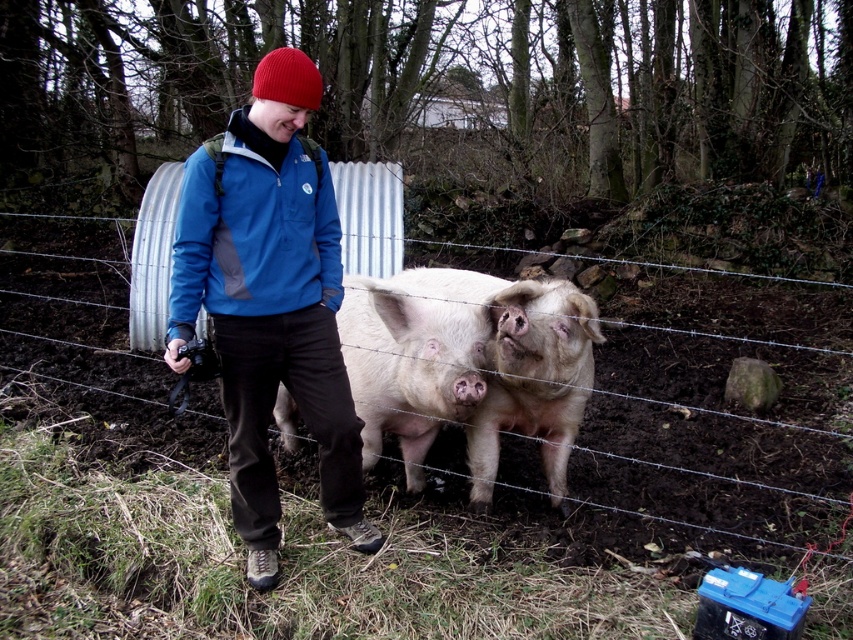
Who is higher up, blue fleece jacket at center or pinkish-white flesh at center?

blue fleece jacket at center is above.

Based on the photo, which is more to the left, blue fleece jacket at center or pinkish-white flesh at center?

From the viewer's perspective, blue fleece jacket at center appears more on the left side.

Is point (274, 81) farther from viewer compared to point (416, 332)?

No, (274, 81) is in front of (416, 332).

I want to click on blue fleece jacket at center, so click(270, 301).

Is barbed wire fence at center shorter than pink soft fur at center?

Incorrect, barbed wire fence at center's height does not fall short of pink soft fur at center's.

Where is `barbed wire fence at center`? The image size is (853, 640). barbed wire fence at center is located at coordinates (701, 452).

Who is more distant from viewer, (x=201, y=394) or (x=529, y=316)?

Point (x=201, y=394)

Locate an element on the screen. barbed wire fence at center is located at coordinates tap(701, 452).

Who is positioned more to the left, barbed wire fence at center or blue fleece jacket at center?

From the viewer's perspective, barbed wire fence at center appears more on the left side.

Between point (775, 561) and point (267, 388), which one is positioned behind?

The point (775, 561) is behind.

Find the location of a particular element. The width and height of the screenshot is (853, 640). barbed wire fence at center is located at coordinates (701, 452).